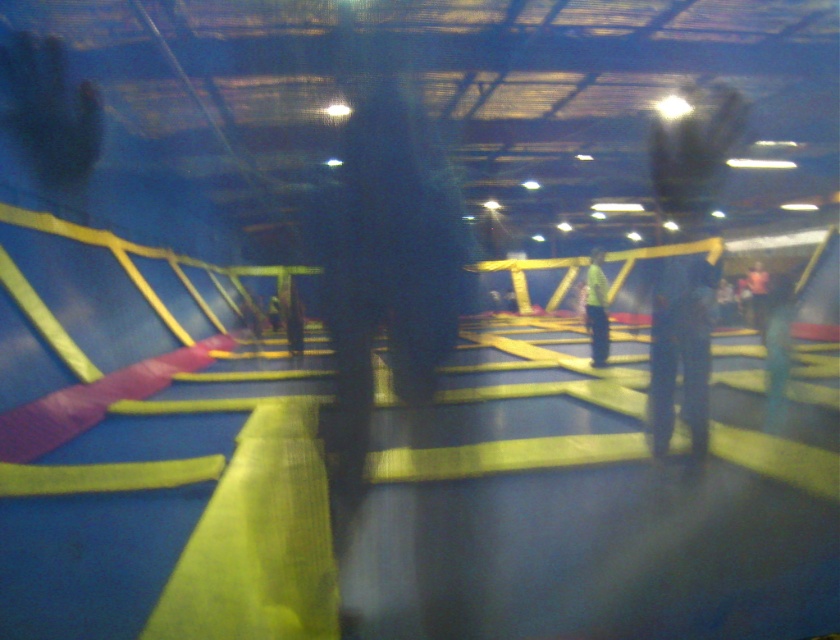
Question: Which of the following is the closest to the observer?

Choices:
 (A) (602, 259)
 (B) (756, 296)

Answer: (B)

Question: Is the position of yellow matte shirt at center less distant than that of dark brown leather jacket at center?

Choices:
 (A) yes
 (B) no

Answer: (A)

Question: Does yellow matte shirt at center have a lesser width compared to dark brown leather jacket at center?

Choices:
 (A) yes
 (B) no

Answer: (B)

Question: Which point is farther to the camera?

Choices:
 (A) dark brown leather jacket at center
 (B) yellow matte shirt at center

Answer: (A)

Question: Can you confirm if yellow matte shirt at center is positioned below dark brown leather jacket at center?

Choices:
 (A) yes
 (B) no

Answer: (B)

Question: Which point is closer to the camera?

Choices:
 (A) dark brown leather jacket at center
 (B) yellow matte shirt at center

Answer: (B)